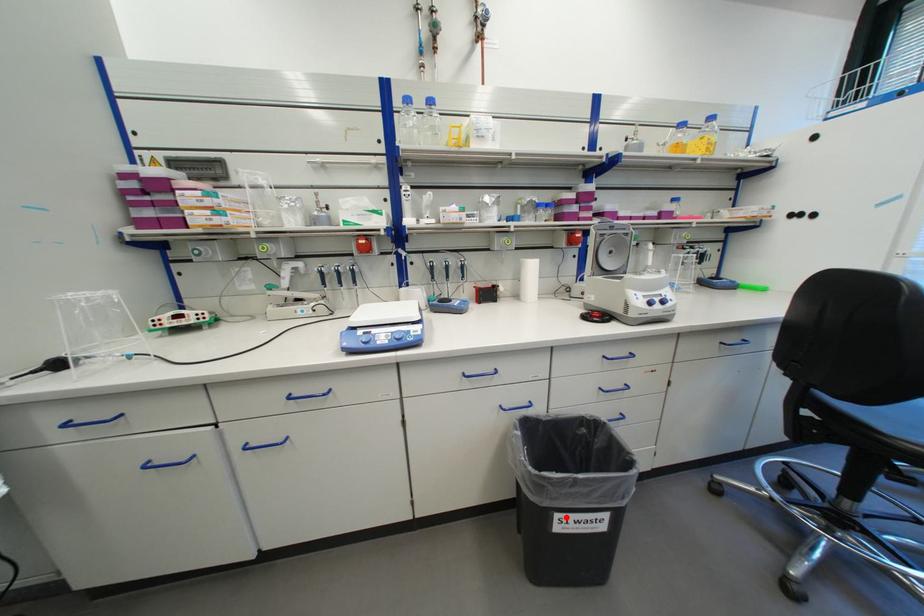
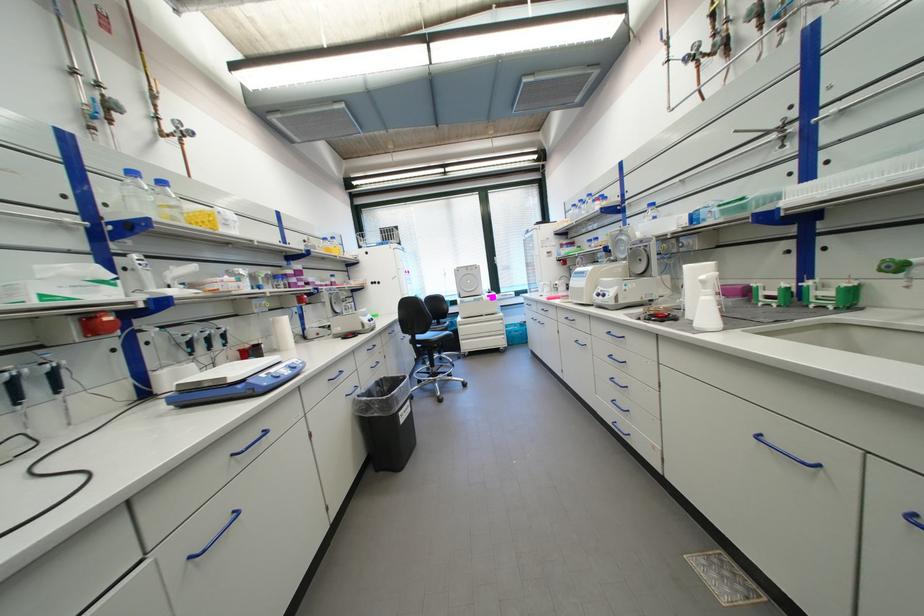
Question: I am providing you with two images of the same scene from different viewpoints. Given a red point in image1, look at the same physical point in image2. Is it:

Choices:
 (A) Closer to the viewpoint
 (B) Farther from the viewpoint

Answer: (A)